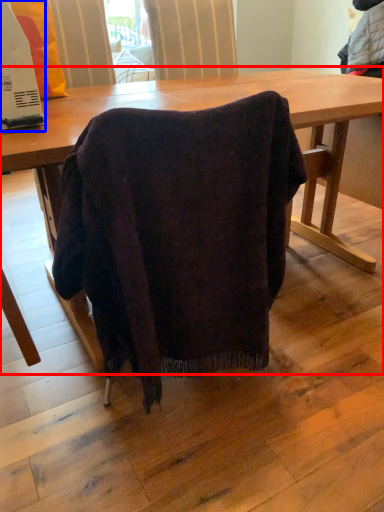
Question: Which object appears closest to the camera in this image, table (highlighted by a red box) or appliance (highlighted by a blue box)?

Choices:
 (A) table
 (B) appliance

Answer: (A)